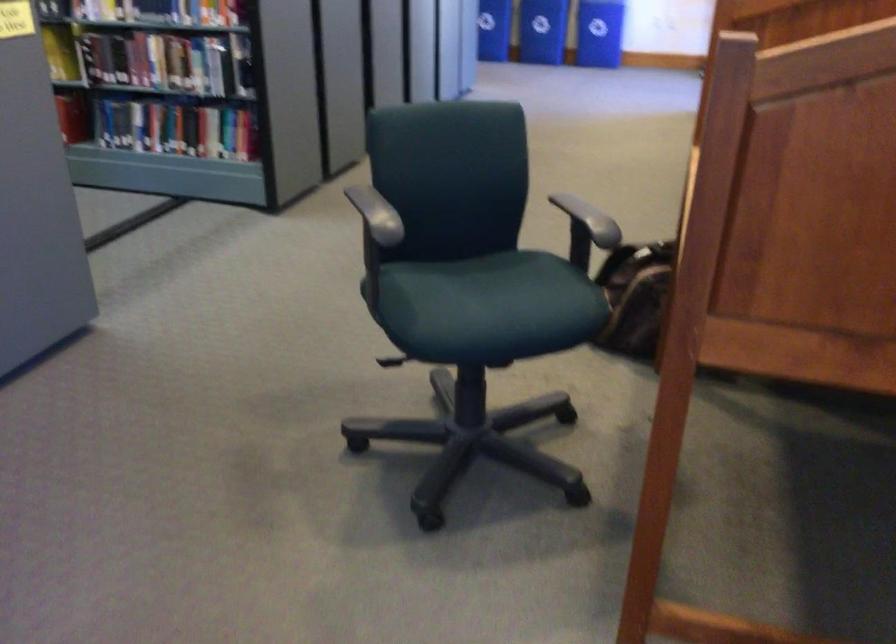
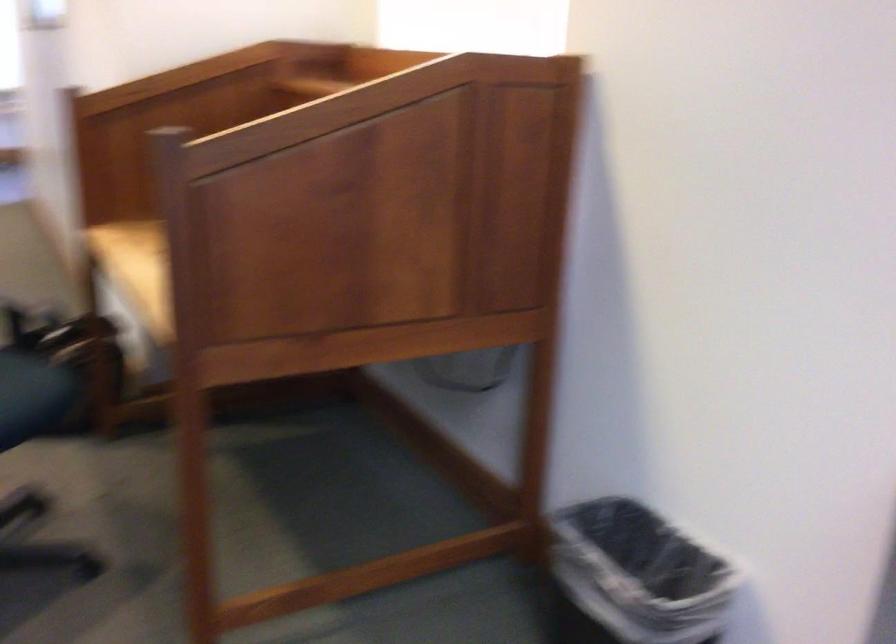
Question: Based on the continuous images, in which direction is the camera rotating? Reply with the corresponding letter.

Choices:
 (A) Left
 (B) Right
 (C) Up
 (D) Down

Answer: (B)